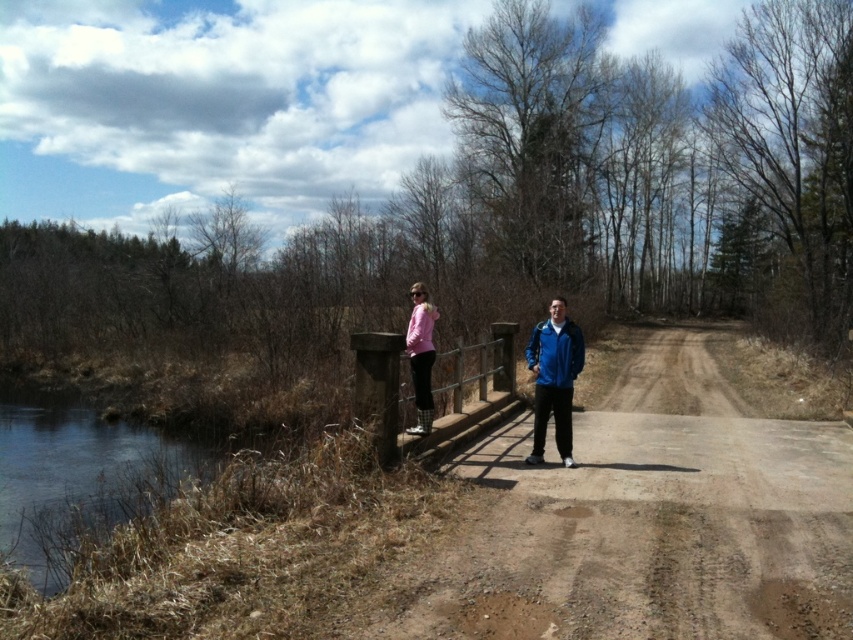
Which is behind, point (80, 412) or point (567, 456)?

Positioned behind is point (80, 412).

Who is more distant from viewer, (44, 545) or (527, 339)?

The point (527, 339) is more distant.

This screenshot has height=640, width=853. I want to click on clear water at lower left, so click(x=74, y=472).

Is matte pink sweater at center to the right of pink matte jacket at center from the viewer's perspective?

Correct, you'll find matte pink sweater at center to the right of pink matte jacket at center.

Is point (538, 394) closer to camera compared to point (419, 324)?

No, (538, 394) is behind (419, 324).

Identify the location of matte pink sweater at center. The width and height of the screenshot is (853, 640). (554, 378).

Does clear water at lower left have a lesser width compared to blue fabric jacket at center?

In fact, clear water at lower left might be wider than blue fabric jacket at center.

Looking at this image, is clear water at lower left in front of blue fabric jacket at center?

Yes.

Does point (12, 410) come behind point (538, 374)?

Yes, it is.

I want to click on clear water at lower left, so click(74, 472).